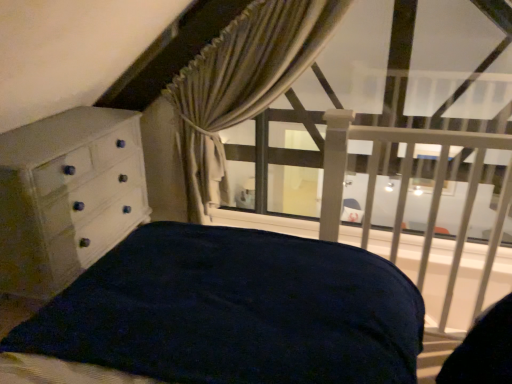
Question: From a real-world perspective, is white matte balustrade at upper right on beige textured curtain at upper center?

Choices:
 (A) yes
 (B) no

Answer: (B)

Question: Is white matte balustrade at upper right positioned beyond the bounds of beige textured curtain at upper center?

Choices:
 (A) no
 (B) yes

Answer: (B)

Question: Does white matte balustrade at upper right appear on the right side of beige textured curtain at upper center?

Choices:
 (A) no
 (B) yes

Answer: (B)

Question: Considering the relative sizes of white matte balustrade at upper right and beige textured curtain at upper center in the image provided, is white matte balustrade at upper right wider than beige textured curtain at upper center?

Choices:
 (A) yes
 (B) no

Answer: (A)

Question: Is beige textured curtain at upper center completely or partially inside white matte balustrade at upper right?

Choices:
 (A) no
 (B) yes

Answer: (A)

Question: Could you tell me if white matte balustrade at upper right is turned towards beige textured curtain at upper center?

Choices:
 (A) no
 (B) yes

Answer: (A)

Question: Is white painted wood chest of drawers at left outside beige textured curtain at upper center?

Choices:
 (A) no
 (B) yes

Answer: (B)

Question: Considering the relative sizes of white painted wood chest of drawers at left and beige textured curtain at upper center in the image provided, is white painted wood chest of drawers at left smaller than beige textured curtain at upper center?

Choices:
 (A) no
 (B) yes

Answer: (A)

Question: Considering the relative sizes of white painted wood chest of drawers at left and beige textured curtain at upper center in the image provided, is white painted wood chest of drawers at left shorter than beige textured curtain at upper center?

Choices:
 (A) no
 (B) yes

Answer: (B)

Question: Does white painted wood chest of drawers at left have a greater width compared to beige textured curtain at upper center?

Choices:
 (A) yes
 (B) no

Answer: (A)

Question: Considering the relative positions of white painted wood chest of drawers at left and beige textured curtain at upper center in the image provided, is white painted wood chest of drawers at left to the right of beige textured curtain at upper center from the viewer's perspective?

Choices:
 (A) yes
 (B) no

Answer: (B)

Question: Is white painted wood chest of drawers at left oriented towards beige textured curtain at upper center?

Choices:
 (A) yes
 (B) no

Answer: (A)

Question: From the image's perspective, is white painted wood chest of drawers at left located beneath white matte balustrade at upper right?

Choices:
 (A) yes
 (B) no

Answer: (B)